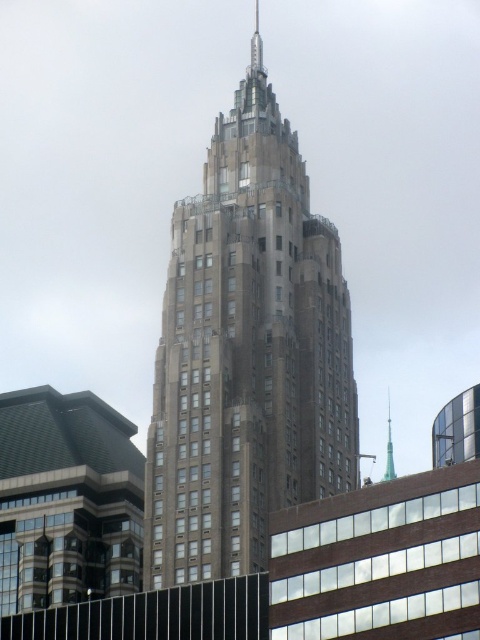
Can you confirm if brown stone tower at center is shorter than green glass spire at upper center?

No.

Looking at this image, can you confirm if brown stone tower at center is positioned to the right of green glass spire at upper center?

No, brown stone tower at center is not to the right of green glass spire at upper center.

Locate an element on the screen. The image size is (480, 640). brown stone tower at center is located at coordinates (247, 353).

Find the location of a particular element. brown stone tower at center is located at coordinates [x=247, y=353].